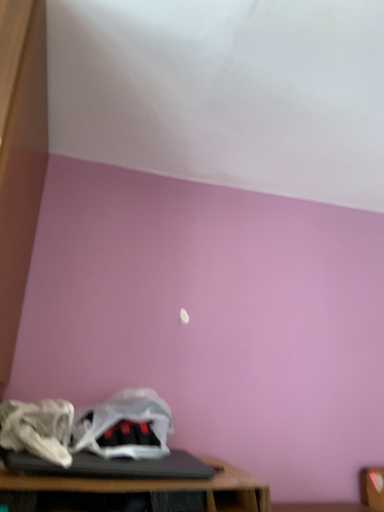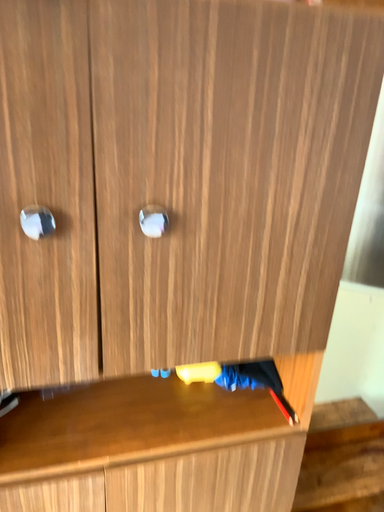
Question: How did the camera likely rotate when shooting the video?

Choices:
 (A) rotated upward
 (B) rotated downward

Answer: (B)